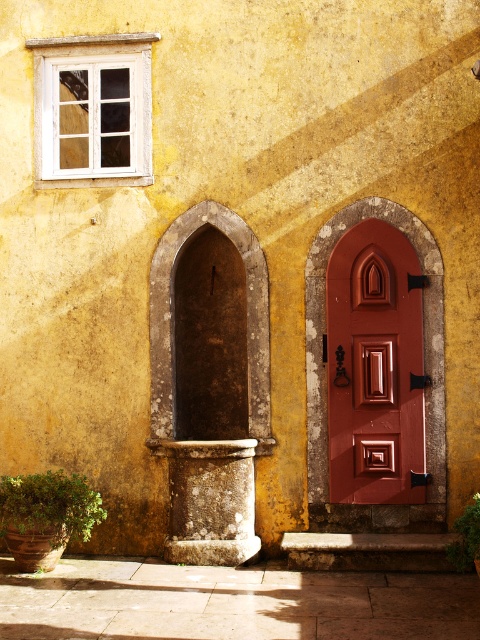
Question: Which object is positioned closest to the white wooden window at upper left?

Choices:
 (A) matte wood door at center
 (B) stone pedestal at center

Answer: (A)

Question: Observing the image, what is the correct spatial positioning of matte wood door at center in reference to white wooden window at upper left?

Choices:
 (A) below
 (B) above

Answer: (A)

Question: Which point is farther to the camera?

Choices:
 (A) matte wood door at center
 (B) brown stone archway at center

Answer: (B)

Question: Can you confirm if white wooden window at upper left is smaller than stone pedestal at center?

Choices:
 (A) yes
 (B) no

Answer: (B)

Question: Which point is farther to the camera?

Choices:
 (A) white wooden window at upper left
 (B) stone pedestal at center
 (C) brown stone archway at center
 (D) matte wood door at center

Answer: (A)

Question: Can you confirm if brown stone archway at center is smaller than stone pedestal at center?

Choices:
 (A) no
 (B) yes

Answer: (A)